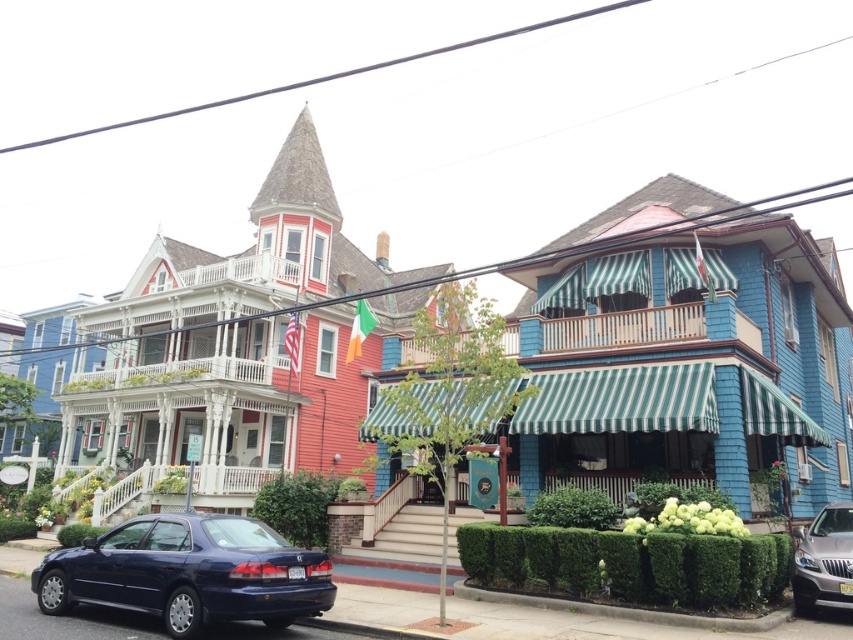
Question: Where is shiny dark blue sedan at lower left located in relation to green textured curb at lower right in the image?

Choices:
 (A) right
 (B) left

Answer: (B)

Question: Which point is closer to the camera taking this photo?

Choices:
 (A) click(416, 586)
 (B) click(624, 616)

Answer: (B)

Question: Which object is closer to the camera taking this photo?

Choices:
 (A) shiny dark blue sedan at lower left
 (B) red concrete curb at lower center

Answer: (A)

Question: Considering the real-world distances, which object is farthest from the matte red house at center?

Choices:
 (A) shiny dark blue sedan at lower left
 (B) silver metallic suv at lower right

Answer: (B)

Question: Is shiny dark blue sedan at lower left smaller than red concrete curb at lower center?

Choices:
 (A) no
 (B) yes

Answer: (A)

Question: Where is green leafy hedge at lower center located in relation to green textured curb at lower right in the image?

Choices:
 (A) above
 (B) below

Answer: (A)